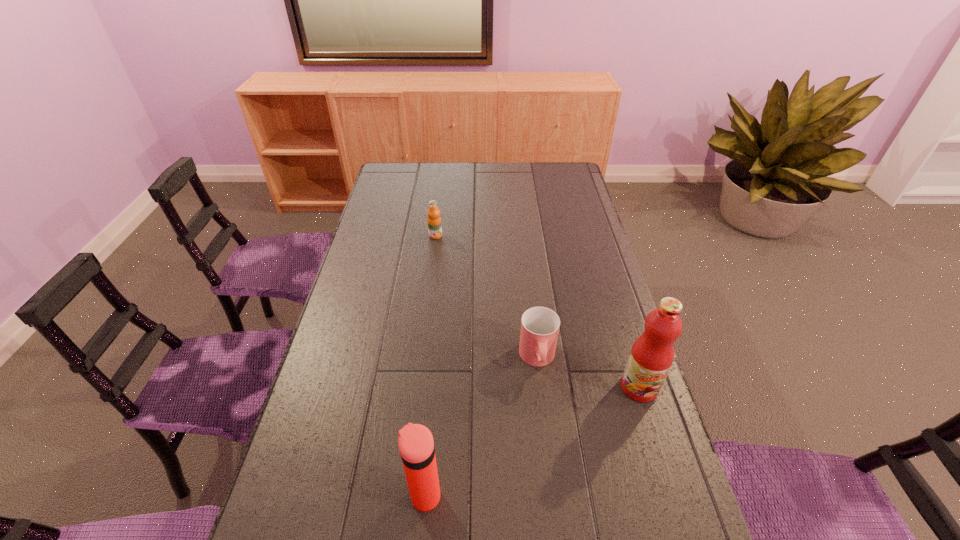
This screenshot has height=540, width=960. In order to click on vacant space on the desktop that is between the thermos bottle and the rightmost object and is positioned on the side of the third object from left to right with the handle in this screenshot , I will do `click(546, 434)`.

Locate an element on the screen. free space on the desktop that is between the nearest object and the rightmost object and is positioned on the label of the orange juice is located at coordinates (558, 428).